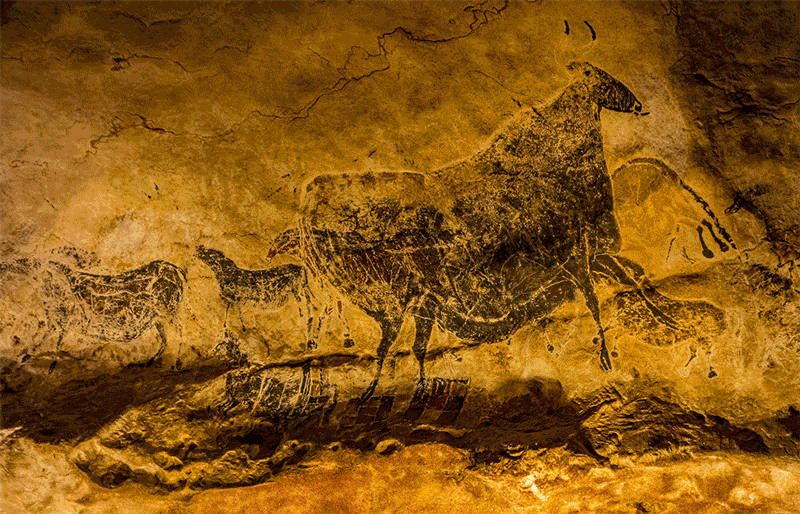
This screenshot has height=514, width=800. What are the coordinates of `orange paint` in the screenshot? It's located at (410, 190).